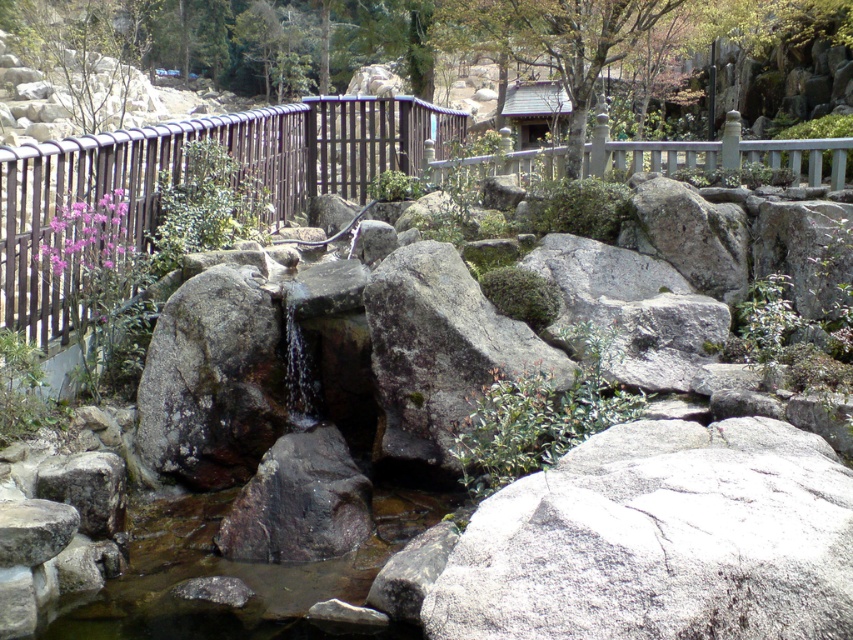
Question: Which point appears farthest from the camera in this image?

Choices:
 (A) (637, 593)
 (B) (351, 490)

Answer: (B)

Question: Considering the real-world distances, which object is farthest from the dark gray rough rock at center?

Choices:
 (A) green mossy rock at center
 (B) gray rough rock at center

Answer: (B)

Question: Among these objects, which one is nearest to the camera?

Choices:
 (A) green mossy rock at center
 (B) dark gray rough rock at center
 (C) gray rough rock at center

Answer: (C)

Question: Is gray rough rock at center above dark gray rough rock at center?

Choices:
 (A) no
 (B) yes

Answer: (B)

Question: Is the position of gray rough rock at center less distant than that of green mossy rock at center?

Choices:
 (A) no
 (B) yes

Answer: (B)

Question: Is gray rough rock at center above dark gray rough rock at center?

Choices:
 (A) yes
 (B) no

Answer: (A)